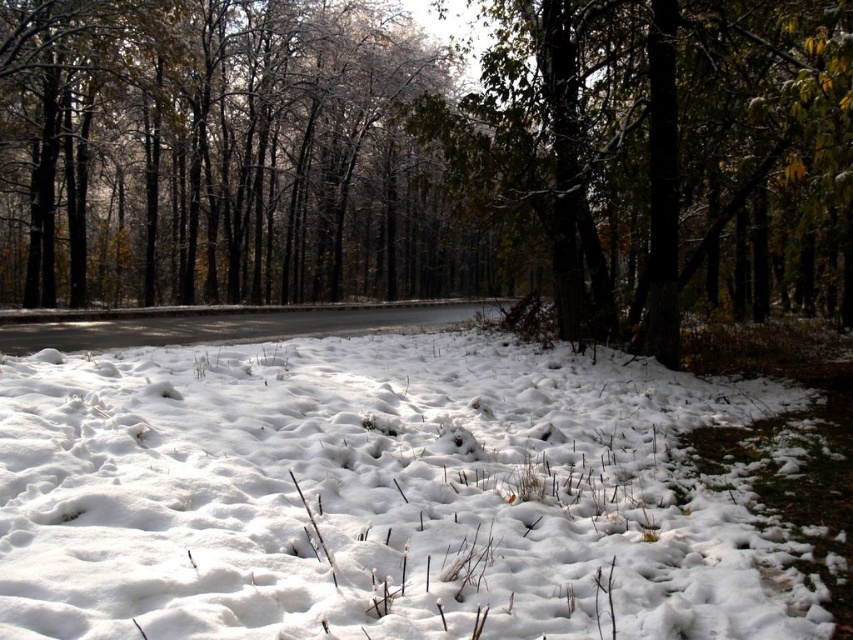
You are a hiker trying to cross the snow at center. You notice there is white fluffy snow at center and frosty bark trees at center. Which one has a smaller width? Please answer based on the scene description.

The white fluffy snow at center has a lesser width compared to frosty bark trees at center, so the white fluffy snow at center is narrower.

You are standing at the edge of the snowy forest and see a point marked at coordinates (221, 154). What object is located at that point?

The point at (221, 154) corresponds to frosty bark trees at center.